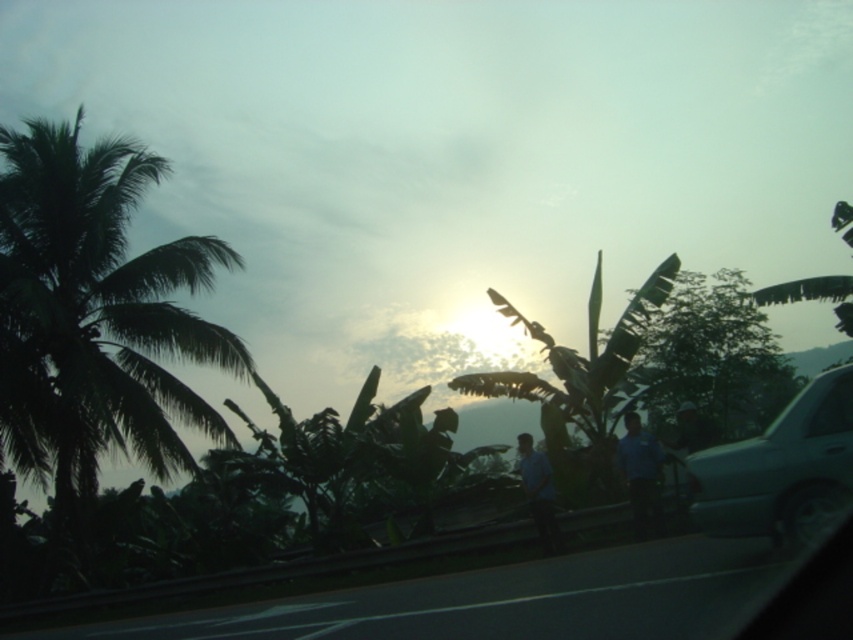
You are driving a car and notice a blue cotton shirt at center on the side of the road. You want to pick it up. Can you safely reach it from your current position inside the transparent glass car window at right without leaving the car?

The blue cotton shirt at center is 4.89 meters away from the transparent glass car window at right. Since the distance is too far to reach from inside the car, you cannot safely pick it up without exiting the vehicle.

You are a pedestrian standing on the road and see the blue uniform shirt at center and the transparent glass car window at right. Which object is closer to the ground?

The blue uniform shirt at center is below transparent glass car window at right, so the blue uniform shirt at center is closer to the ground.

You are a passenger in a car driving along this rural road. You notice the transparent glass car window at right and the blue fabric shirt at center. Which object is higher relative to your viewpoint?

The transparent glass car window at right is above the blue fabric shirt at center, so the transparent glass car window at right is higher.